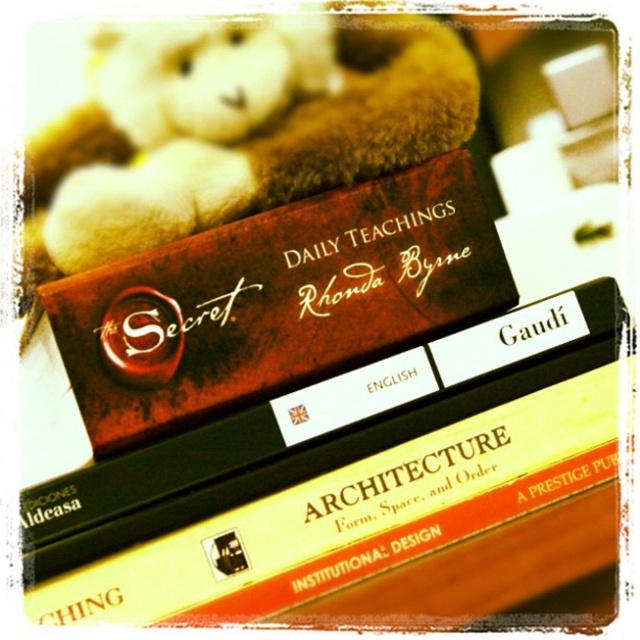
Measure the distance from hardcover book at upper center to matte brown book at center.

They are 3.12 inches apart.

Who is higher up, hardcover book at upper center or matte brown book at center?

matte brown book at center

Between point (56, 536) and point (413, 291), which one is positioned in front?

Point (56, 536)

Where is `hardcover book at upper center`? hardcover book at upper center is located at coordinates (336, 477).